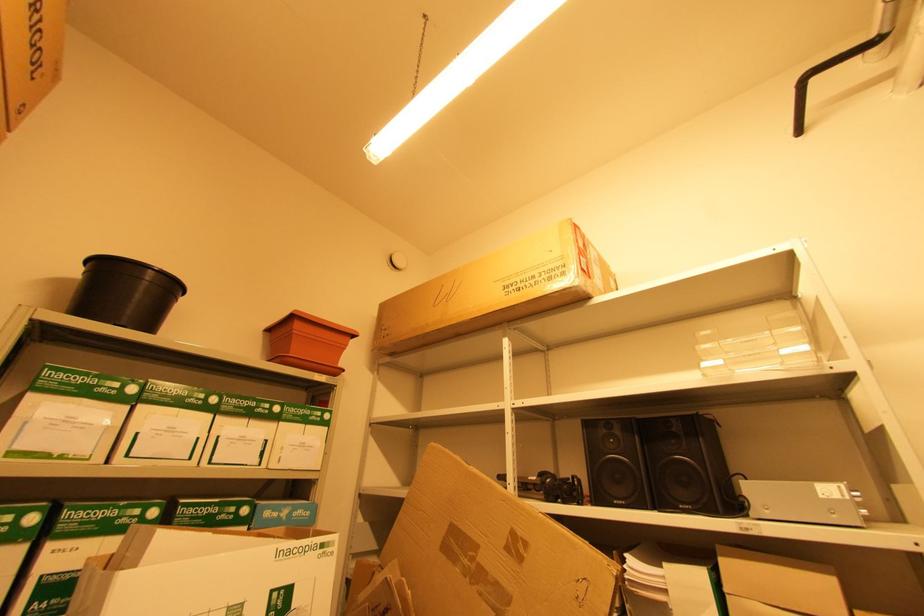
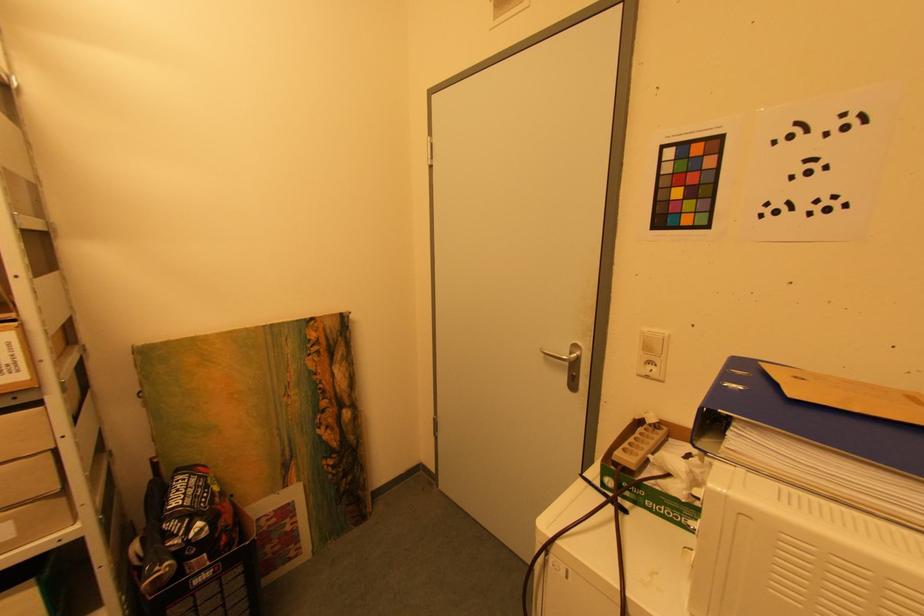
Question: The first image is from the beginning of the video and the second image is from the end. How did the camera likely rotate when shooting the video?

Choices:
 (A) Left
 (B) Right
 (C) Up
 (D) Down

Answer: (B)